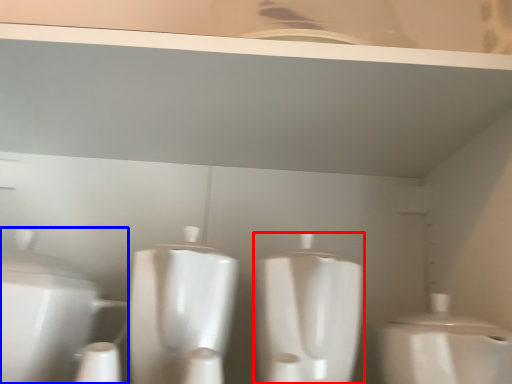
Question: Which object is further to the camera taking this photo, toilet (highlighted by a red box) or toilet (highlighted by a blue box)?

Choices:
 (A) toilet
 (B) toilet

Answer: (B)